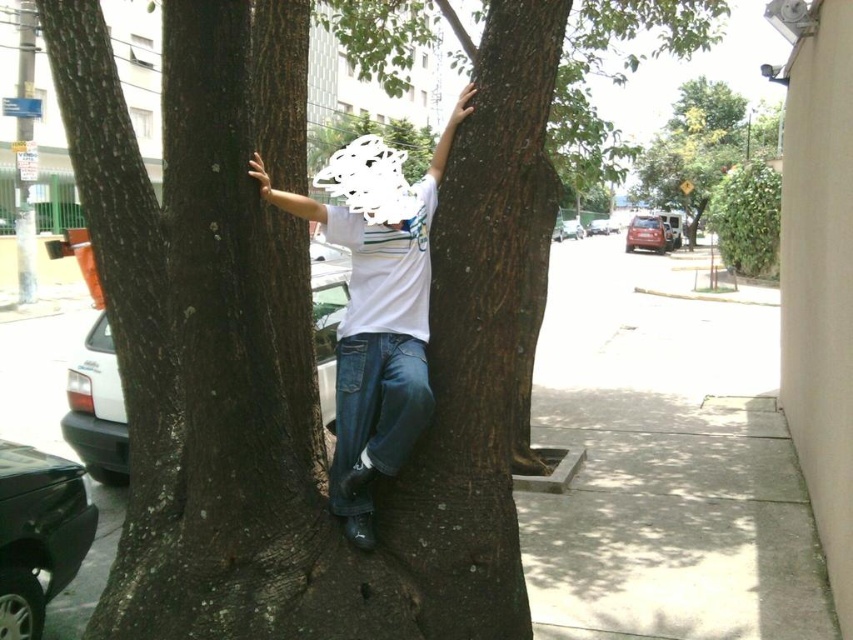
How much distance is there between white matte shirt at center and green leafy tree at upper right?

white matte shirt at center and green leafy tree at upper right are 116.15 feet apart.

Does white matte shirt at center appear over green leafy tree at upper right?

Incorrect, white matte shirt at center is not positioned above green leafy tree at upper right.

Does point (358, 353) lie in front of point (665, 205)?

Yes, it is.

Locate an element on the screen. white matte shirt at center is located at coordinates (376, 333).